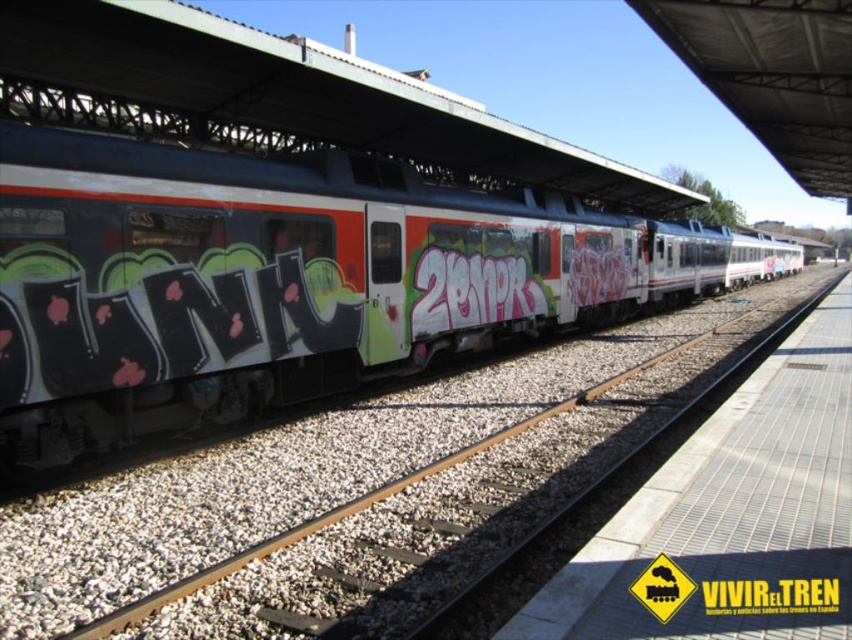
Is matte black train at center taller than metal grid platform at center?

Indeed, matte black train at center has a greater height compared to metal grid platform at center.

Can you confirm if matte black train at center is thinner than metal grid platform at center?

Yes, matte black train at center is thinner than metal grid platform at center.

This screenshot has width=852, height=640. Identify the location of matte black train at center. (286, 280).

You are a GUI agent. You are given a task and a screenshot of the screen. Output one action in this format:
    pyautogui.click(x=<x>, y=<y>)
    Task: Click on the matte black train at center
    The height and width of the screenshot is (640, 852).
    Given the screenshot: What is the action you would take?
    pyautogui.click(x=286, y=280)

How far apart are smooth concrete train track at center and metal grid platform at center?

A distance of 5.54 feet exists between smooth concrete train track at center and metal grid platform at center.

Which is more to the right, smooth concrete train track at center or metal grid platform at center?

metal grid platform at center is more to the right.

Is point (171, 616) behind point (609, 634)?

Yes.

In order to click on smooth concrete train track at center in this screenshot , I will do `click(442, 509)`.

Who is more distant from viewer, (545, 208) or (418, 557)?

Positioned behind is point (545, 208).

Between matte black train at center and smooth concrete train track at center, which one appears on the right side from the viewer's perspective?

From the viewer's perspective, smooth concrete train track at center appears more on the right side.

Measure the distance between matte black train at center and camera.

matte black train at center is 6.13 meters away from camera.

What are the coordinates of `matte black train at center` in the screenshot? It's located at (286, 280).